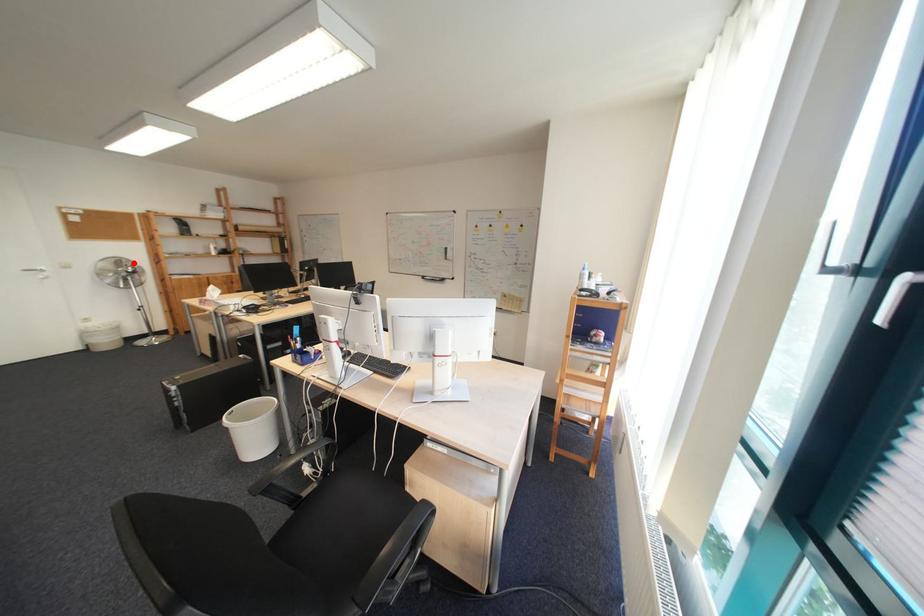
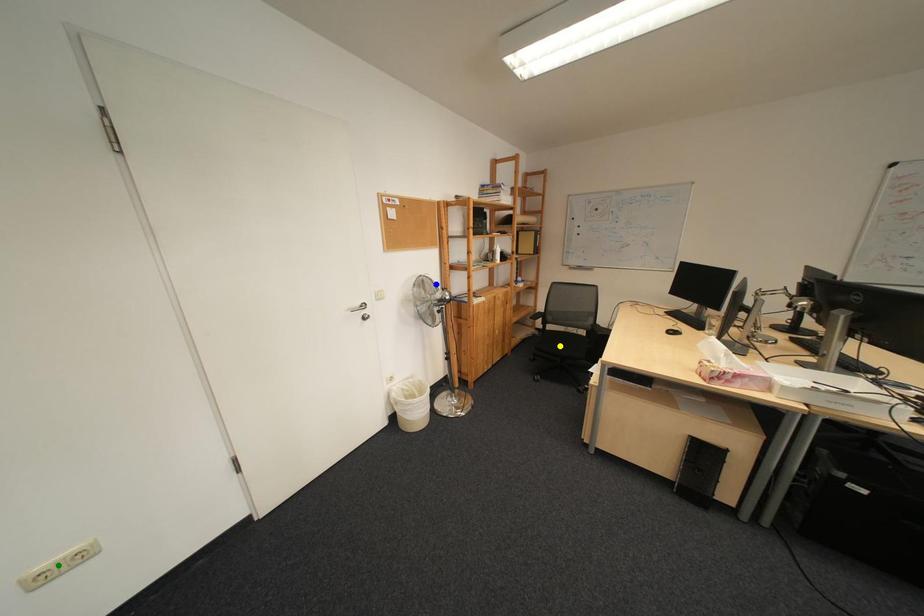
Question: I am providing you with two images of the same scene from different viewpoints. A red point is marked on the first image. You are given multiple points on the second image. Which mark in image 2 goes with the point in image 1?

Choices:
 (A) yellow point
 (B) blue point
 (C) green point

Answer: (B)